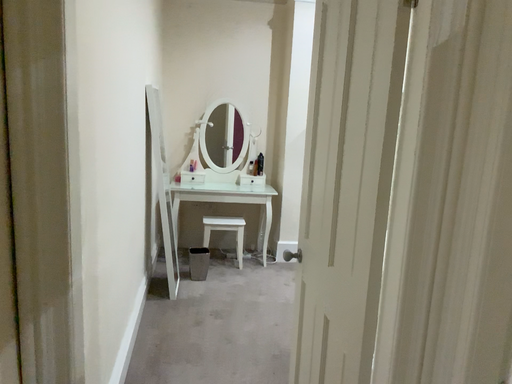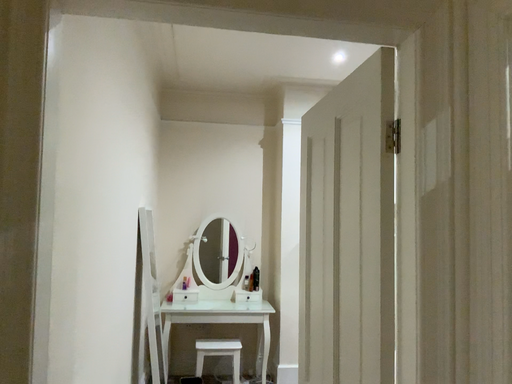
Question: How did the camera likely rotate when shooting the video?

Choices:
 (A) rotated upward
 (B) rotated downward

Answer: (A)